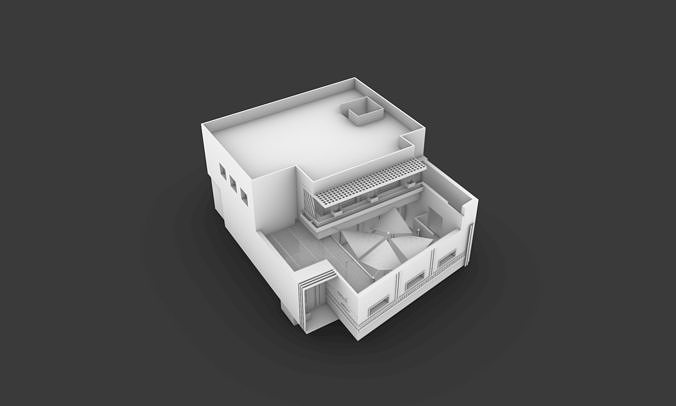
I want to click on panel, so click(x=405, y=167).